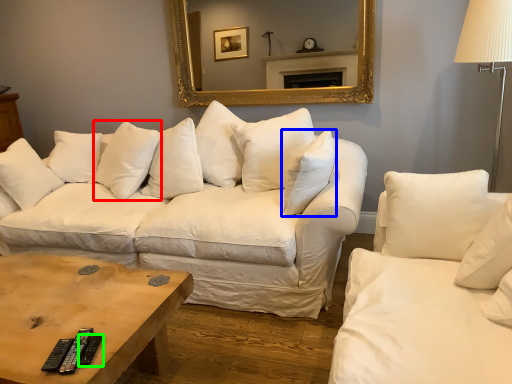
Question: Which is farther away from pillow (highlighted by a red box)? pillow (highlighted by a blue box) or remote (highlighted by a green box)?

Choices:
 (A) pillow
 (B) remote

Answer: (B)